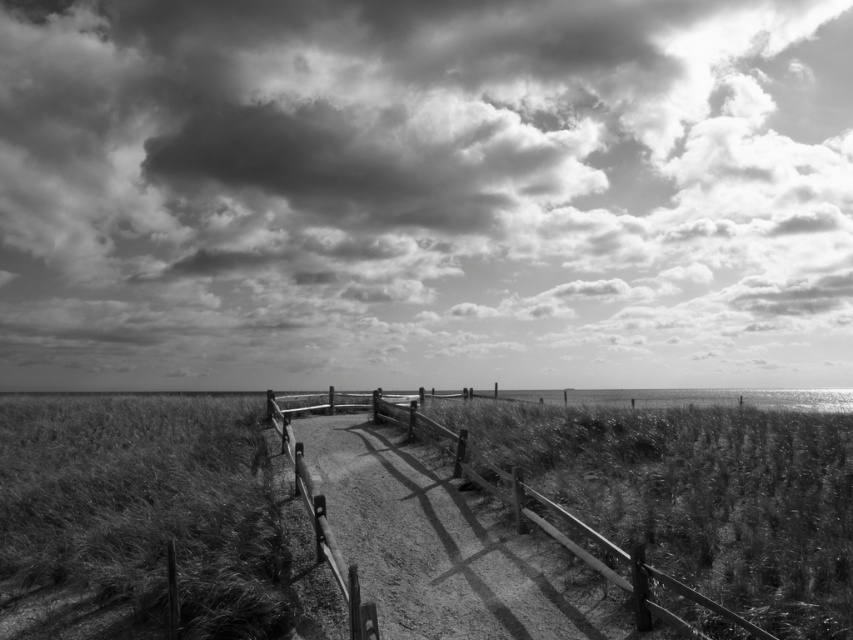
Question: Can you confirm if cloudy sky at upper center is positioned to the left of wooden fence at center?

Choices:
 (A) yes
 (B) no

Answer: (B)

Question: Which point is farther to the camera?

Choices:
 (A) cloudy sky at upper center
 (B) coarse textured grass at lower left

Answer: (A)

Question: Which point appears closest to the camera in this image?

Choices:
 (A) (201, 400)
 (B) (675, 586)
 (C) (521, 209)

Answer: (B)

Question: Is cloudy sky at upper center further to the viewer compared to wooden fence at center?

Choices:
 (A) no
 (B) yes

Answer: (B)

Question: Which point is closer to the camera?

Choices:
 (A) (614, 557)
 (B) (242, 582)

Answer: (A)

Question: Does cloudy sky at upper center lie in front of coarse textured grass at lower left?

Choices:
 (A) yes
 (B) no

Answer: (B)